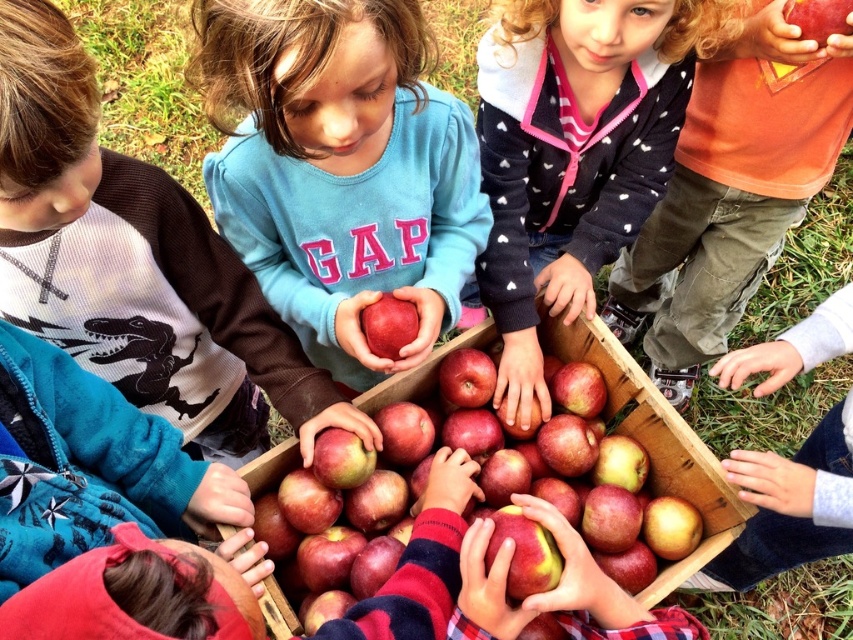
Question: Can you confirm if matte blue sweater at center is smaller than matte red apple at center?

Choices:
 (A) yes
 (B) no

Answer: (B)

Question: Considering the relative positions of matte brown sweater at lower left and matte red apple at center in the image provided, where is matte brown sweater at lower left located with respect to matte red apple at center?

Choices:
 (A) right
 (B) left

Answer: (B)

Question: Which of these objects is positioned farthest from the matte brown sweater at lower left?

Choices:
 (A) shiny red apple at center
 (B) orange cotton shirt at right
 (C) dark blue sweater at center
 (D) matte red apple at center

Answer: (B)

Question: Considering the real-world distances, which object is closest to the matte blue sweater at center?

Choices:
 (A) dark blue sweater at center
 (B) matte brown sweater at lower left
 (C) orange cotton shirt at right
 (D) shiny red apple at center

Answer: (B)

Question: Which point is farther from the camera taking this photo?

Choices:
 (A) (712, 289)
 (B) (62, 40)
 (C) (558, 33)
 (D) (300, 586)

Answer: (A)

Question: Is the position of matte brown sweater at lower left more distant than that of dark blue sweater at center?

Choices:
 (A) yes
 (B) no

Answer: (B)